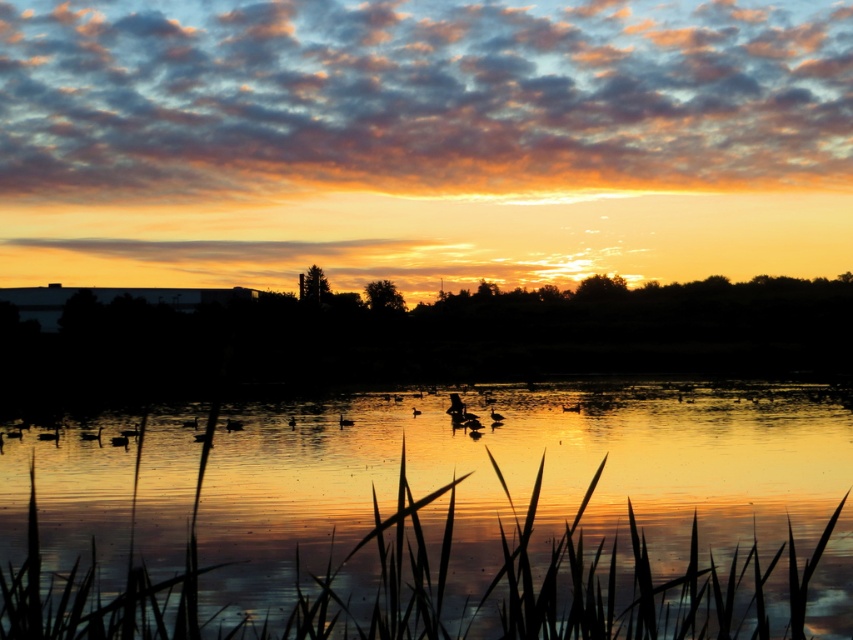
You are standing at the edge of the water and want to place a small floating lantern exactly at the center of the reflective golden water at center. According to the coordinates provided, where should you aim to place it?

The reflective golden water at center is located at point (x=442, y=525), so you should aim to place the lantern at those coordinates to position it exactly at the center of the reflective golden water at center.

You are standing on a wooden dock and want to take a photo of the silhouette feathered duck at lower left without the reflective golden water at center appearing in the foreground. Is this possible based on their positions?

The reflective golden water at center is closer to the viewer than the silhouette feathered duck at lower left, so the duck would be behind the water. To avoid the water in the foreground, you would need to adjust your position so that the duck is not obscured by the water.